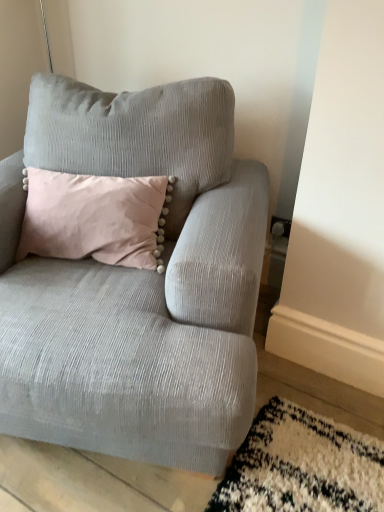
Describe the element at coordinates (137, 283) in the screenshot. I see `velvet gray couch at center` at that location.

The height and width of the screenshot is (512, 384). In order to click on velvet gray couch at center in this screenshot , I will do `click(137, 283)`.

Where is `velvet gray couch at center`? velvet gray couch at center is located at coordinates (137, 283).